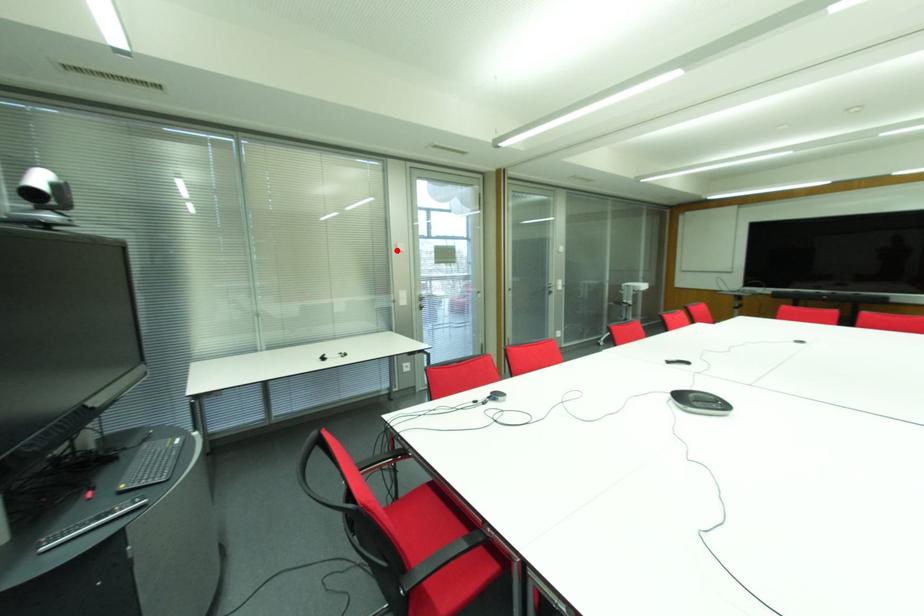
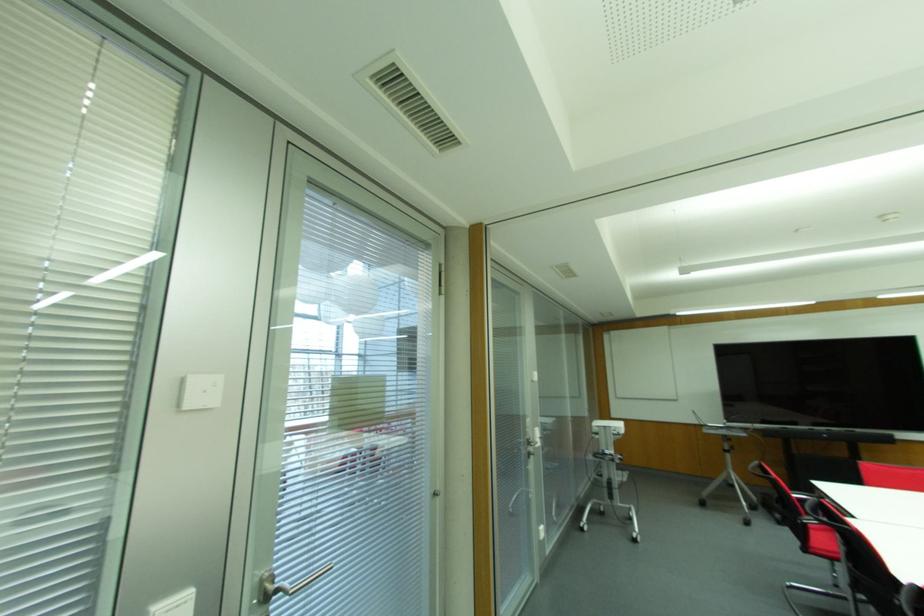
In the second image, find the point that corresponds to the highlighted location in the first image.

(178, 406)